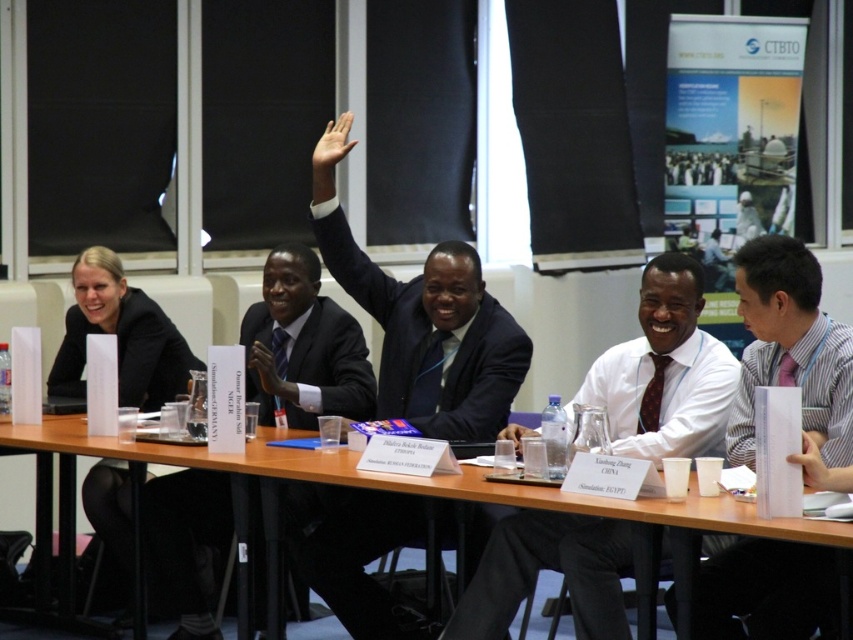
Is dark blue suit at center below brown wooden table at center?

No, dark blue suit at center is not below brown wooden table at center.

How far apart are dark blue suit at center and brown wooden table at center?

dark blue suit at center is 28.07 inches away from brown wooden table at center.

Is point (442, 387) positioned in front of point (206, 467)?

No.

Where is `dark blue suit at center`? dark blue suit at center is located at coordinates (430, 332).

Who is lower down, matte white hand at upper center or smooth skin hand at upper right?

Positioned lower is smooth skin hand at upper right.

Can you confirm if matte white hand at upper center is positioned above smooth skin hand at upper right?

Yes, matte white hand at upper center is above smooth skin hand at upper right.

Does point (344, 124) come behind point (842, 488)?

Yes, point (344, 124) is farther from viewer.

Identify the location of matte white hand at upper center. This screenshot has height=640, width=853. (332, 147).

Is dark blue suit at center further to camera compared to matte white hand at upper center?

Yes, it is.

Does dark blue suit at center have a lesser height compared to matte white hand at upper center?

No.

This screenshot has height=640, width=853. In order to click on dark blue suit at center in this screenshot , I will do `click(430, 332)`.